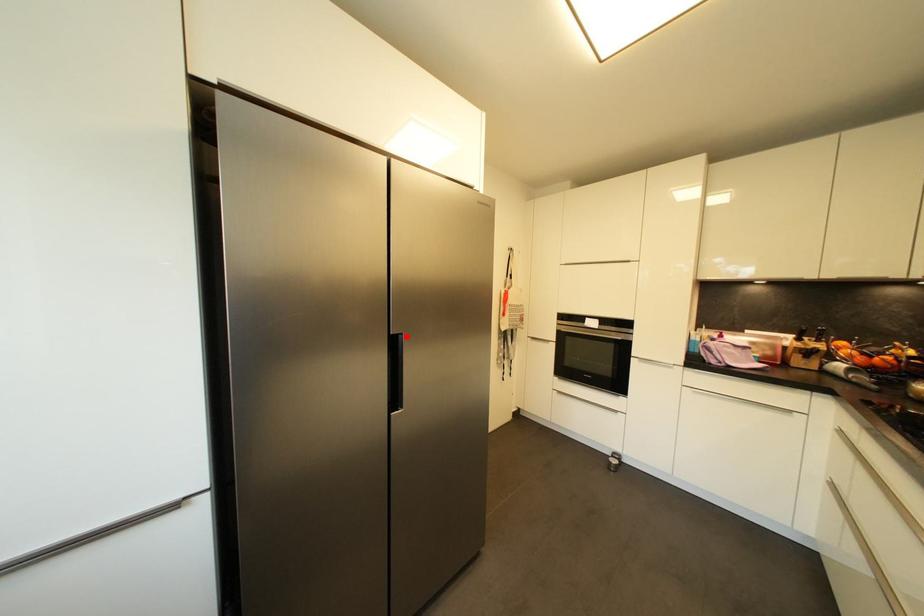
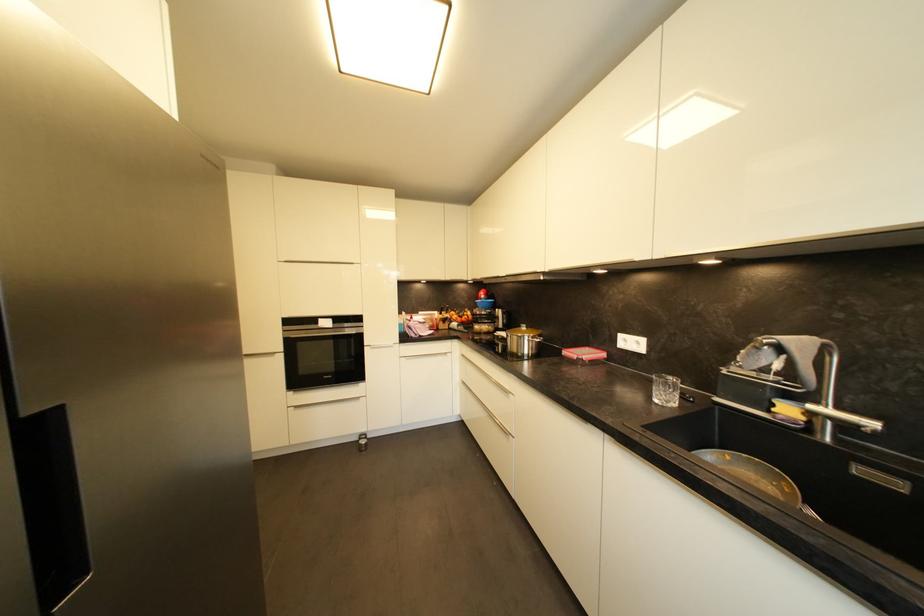
Where in the second image is the point corresponding to the highlighted location from the first image?

(65, 408)